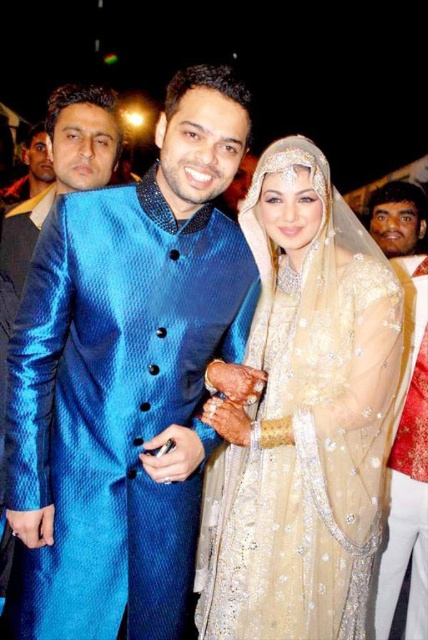
Does ivory satin dress at center have a greater height compared to red satin vest at right?

No, ivory satin dress at center is not taller than red satin vest at right.

Is point (297, 160) behind point (427, 502)?

No.

This screenshot has width=428, height=640. Identify the location of ivory satin dress at center. (303, 419).

Measure the distance between point [270,321] and camera.

They are 7.42 feet apart.

Locate an element on the screen. ivory satin dress at center is located at coordinates (303, 419).

In order to click on red satin vest at right in this screenshot , I will do `click(406, 419)`.

Can you confirm if red satin vest at right is positioned above blue silk sherwani at left?

No.

Where is `red satin vest at right`? red satin vest at right is located at coordinates (406, 419).

You are a GUI agent. You are given a task and a screenshot of the screen. Output one action in this format:
    pyautogui.click(x=<x>, y=<y>)
    Task: Click on the red satin vest at right
    The image size is (428, 640).
    Given the screenshot: What is the action you would take?
    pyautogui.click(x=406, y=419)